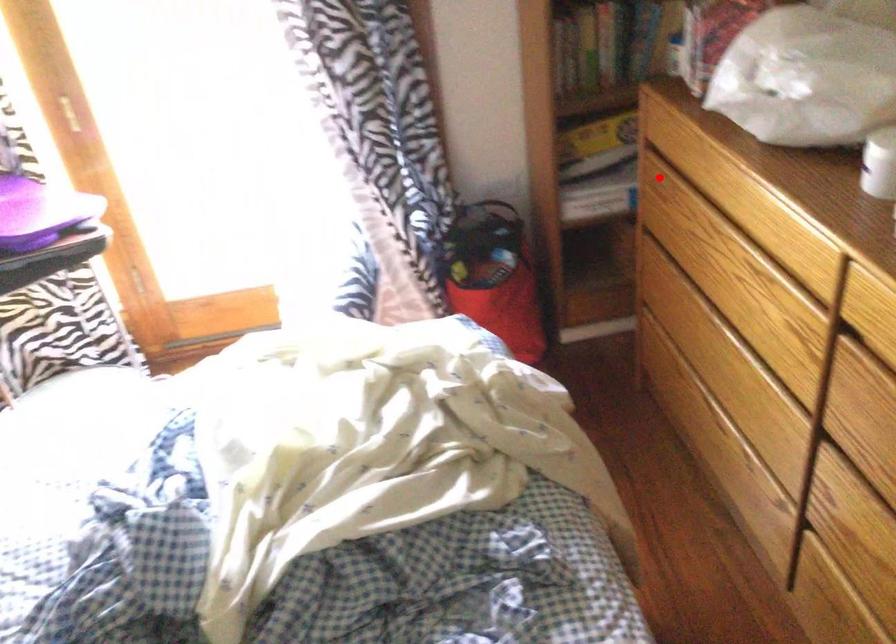
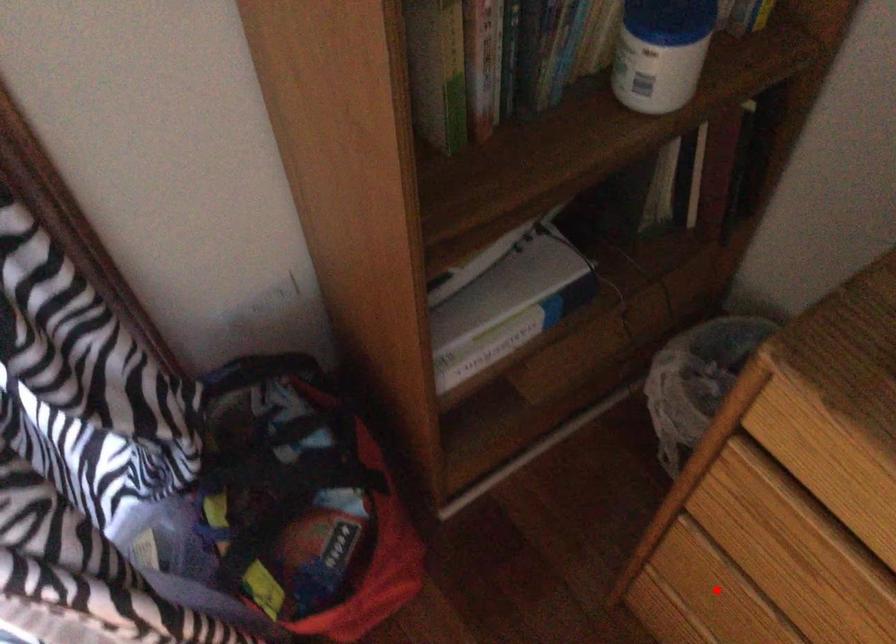
I am providing you with two images of the same scene from different viewpoints. A red point is marked on the first image and another point is marked on the second image. Is the marked point in image1 the same physical position as the marked point in image2?

No